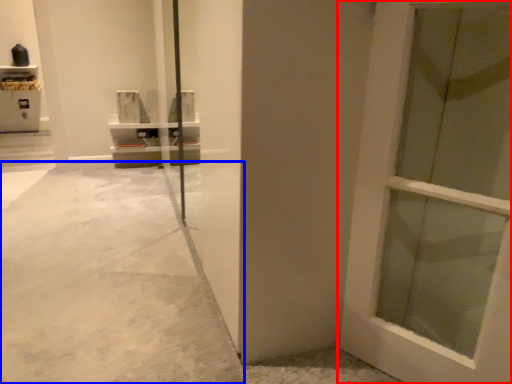
Question: Which point is closer to the camera, door (highlighted by a red box) or concrete (highlighted by a blue box)?

Choices:
 (A) door
 (B) concrete

Answer: (A)